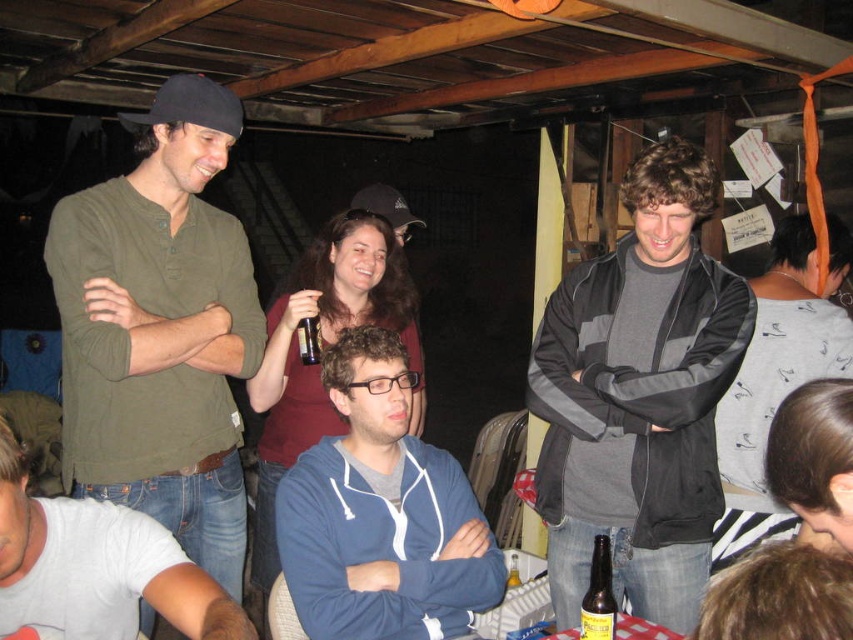
Who is taller, gray cotton t-shirt at lower left or black plastic cup at center?

gray cotton t-shirt at lower left

Can you confirm if gray cotton t-shirt at lower left is smaller than black plastic cup at center?

No, gray cotton t-shirt at lower left is not smaller than black plastic cup at center.

Who is more distant from viewer, (154, 556) or (312, 332)?

The point (312, 332) is more distant.

Locate an element on the screen. This screenshot has width=853, height=640. gray cotton t-shirt at lower left is located at coordinates coord(96,566).

Can you confirm if green matte shirt at upper left is smaller than black plastic cup at center?

No.

Is green matte shirt at upper left to the right of black plastic cup at center from the viewer's perspective?

In fact, green matte shirt at upper left is to the left of black plastic cup at center.

Between point (169, 449) and point (299, 324), which one is positioned in front?

Point (169, 449) is in front.

Identify the location of green matte shirt at upper left. (160, 330).

Does dark gray fleece jacket at center appear over brown glass bottle at center?

Indeed, dark gray fleece jacket at center is positioned over brown glass bottle at center.

Which is more to the right, dark gray fleece jacket at center or brown glass bottle at center?

From the viewer's perspective, dark gray fleece jacket at center appears more on the right side.

What are the coordinates of `dark gray fleece jacket at center` in the screenshot? It's located at (639, 397).